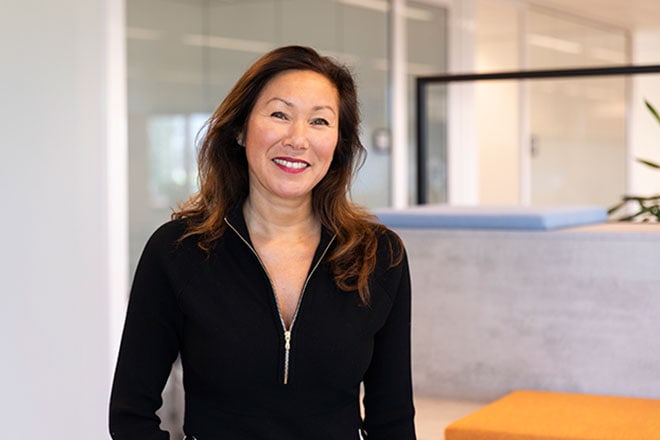
You are a GUI agent. You are given a task and a screenshot of the screen. Output one action in this format:
    pyautogui.click(x=<x>, y=<y>)
    Task: Click on the clock on the wall
    
    Given the screenshot: What is the action you would take?
    pyautogui.click(x=381, y=136)